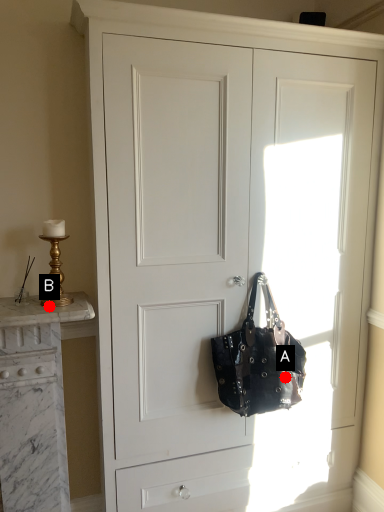
Question: Two points are circled on the image, labeled by A and B beside each circle. Among these points, which one is nearest to the camera?

Choices:
 (A) A is closer
 (B) B is closer

Answer: (B)